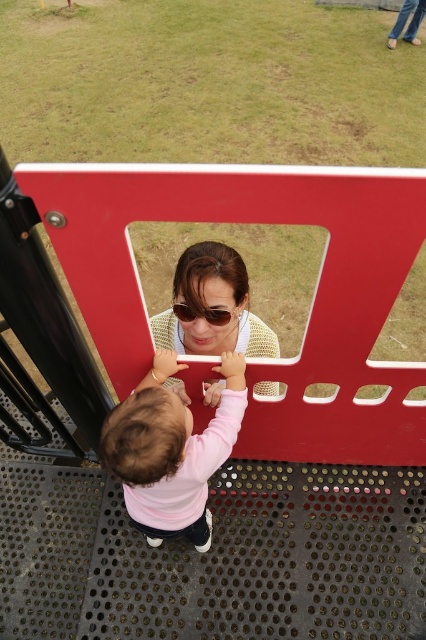
Between point (236, 362) and point (204, 307), which one is positioned in front?

Positioned in front is point (236, 362).

Is pink fabric toddler at center to the left of sunglasses at center from the viewer's perspective?

Indeed, pink fabric toddler at center is positioned on the left side of sunglasses at center.

Who is more distant from viewer, (210, 429) or (215, 310)?

Point (215, 310)

I want to click on pink fabric toddler at center, so click(x=170, y=451).